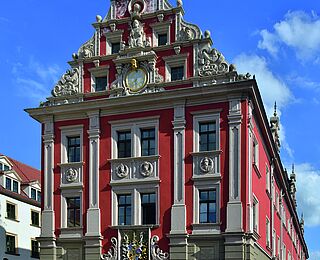
Locate an element on the screen. Image resolution: width=320 pixels, height=260 pixels. window is located at coordinates (145, 139).